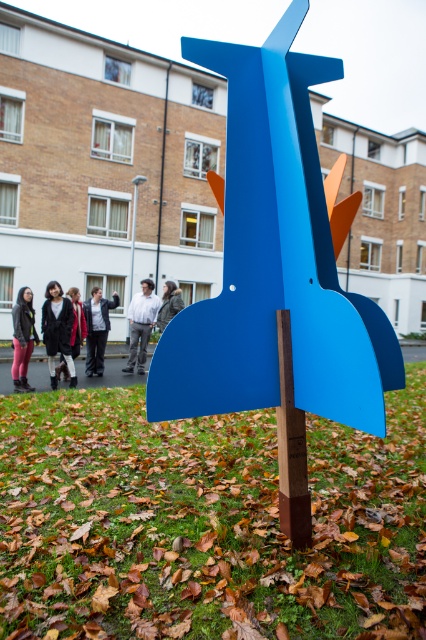
Question: Does black fur coat at lower left have a larger size compared to dark gray jacket at center?

Choices:
 (A) no
 (B) yes

Answer: (A)

Question: Does black fur coat at lower left have a lesser width compared to dark gray jacket at center?

Choices:
 (A) no
 (B) yes

Answer: (A)

Question: Among these points, which one is nearest to the camera?

Choices:
 (A) (239, 237)
 (B) (23, 317)

Answer: (A)

Question: Which point is closer to the camera?

Choices:
 (A) dark gray jacket at center
 (B) matte black jacket at center
 (C) matte black jacket at lower left
 (D) black fur coat at lower left

Answer: (C)

Question: Which object appears farthest from the camera in this image?

Choices:
 (A) dark gray jacket at center
 (B) light gray fabric jacket at center

Answer: (A)

Question: Can you confirm if matte blue rocket at center is positioned below light gray fabric jacket at center?

Choices:
 (A) no
 (B) yes

Answer: (A)